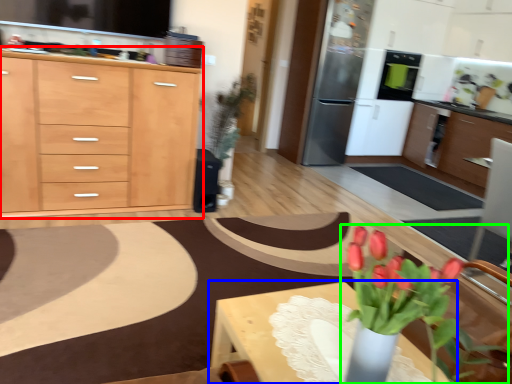
Question: Considering the real-world distances, which object is farthest from cabinetry (highlighted by a red box)? table (highlighted by a blue box) or houseplant (highlighted by a green box)?

Choices:
 (A) table
 (B) houseplant

Answer: (B)